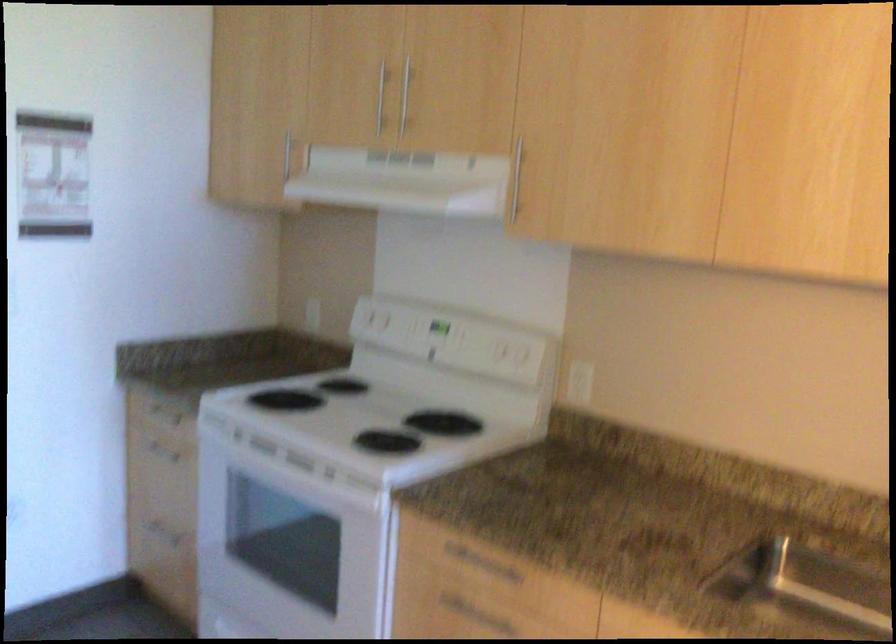
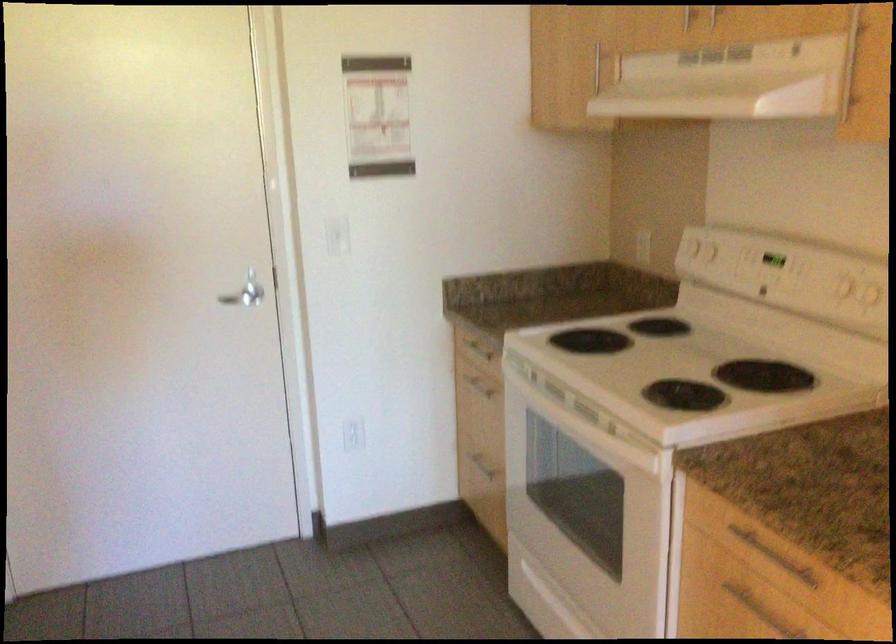
In a continuous first-person perspective shot, in which direction is the camera moving?

The cameraman walked toward right, forward.